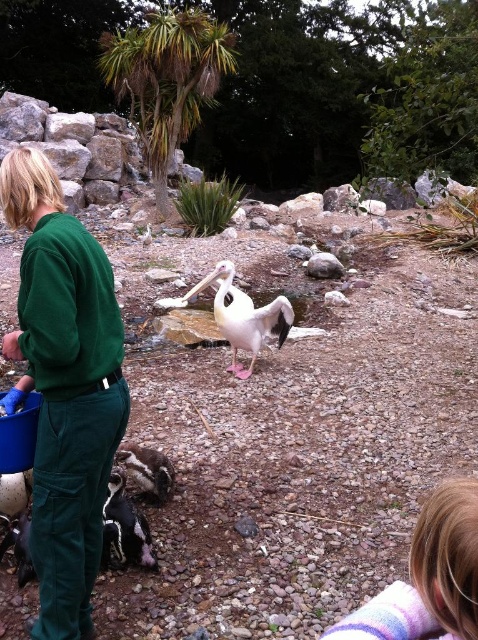
Based on the photo, you are a zookeeper holding a blue bucket and need to distribute food to both the white matte pelican at center and the black and white speckled bird at lower left. Given the distance between them, can you reach both birds with a water hose that has a 5 feet long extension? Please explain your reasoning.

The distance between the white matte pelican at center and the black and white speckled bird at lower left is 5.30 feet. Since the water hose extension is only 5 feet long, it is 0.30 feet shorter than needed. Therefore, the zookeeper cannot reach both birds with the current hose length.

You are a visitor at the zoo and want to take a photo of the blonde hair at lower right and the black glossy penguin at lower left. Which object should you focus on first if you want to capture both in the same frame without moving your camera?

The blonde hair at lower right has a lesser height compared to the black glossy penguin at lower left, so you should focus on the black glossy penguin at lower left first to ensure both are in the frame.

You are a zookeeper holding a blue bucket and need to approach both the white matte pelican at center and the black and white speckled bird at lower left. Which bird should you approach first if you want to reach the one closest to your current position?

The black and white speckled bird at lower left is closer to your current position since the white matte pelican at center is positioned on the right side of it, meaning the pelican is further away to the right.